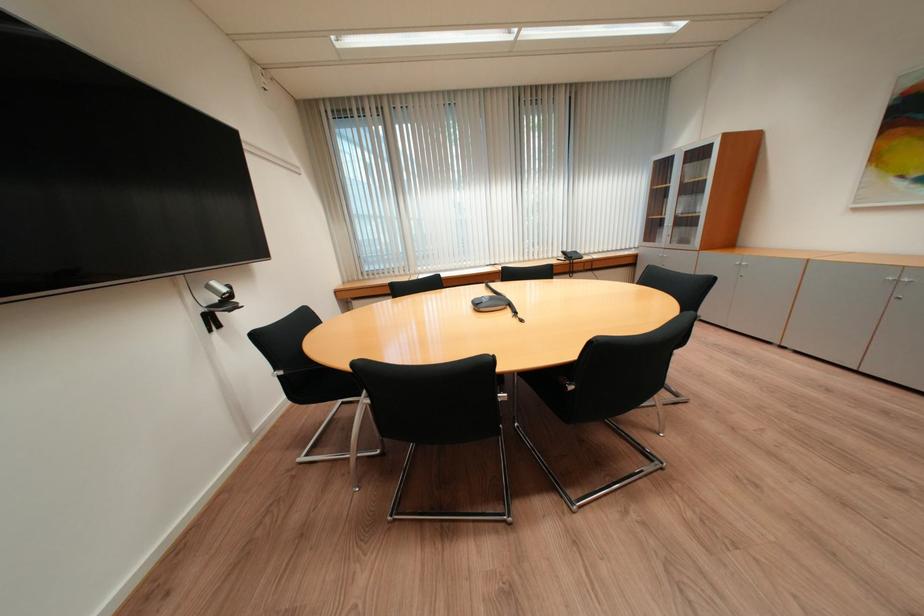
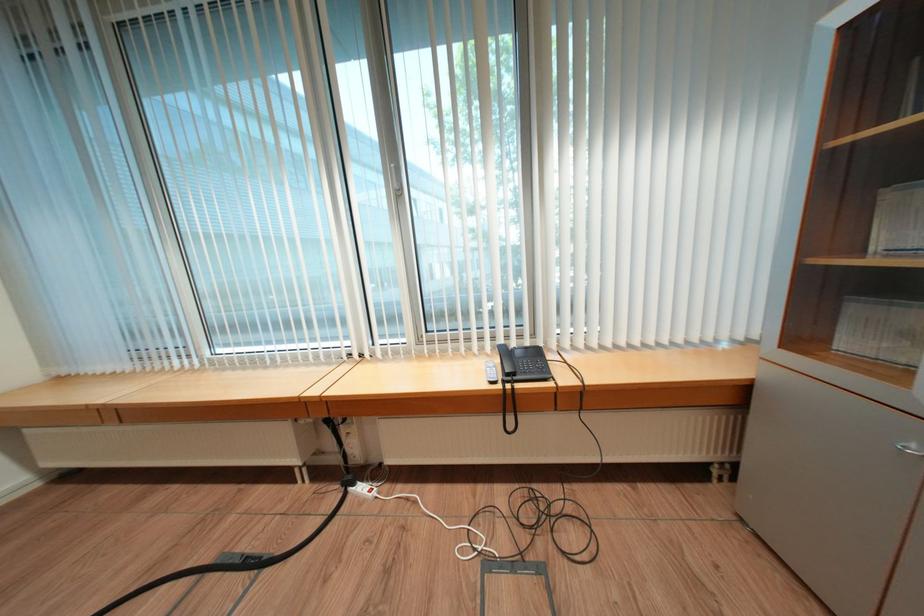
The images are taken continuously from a first-person perspective. In which direction are you moving?

The cameraman moved toward right, forward.